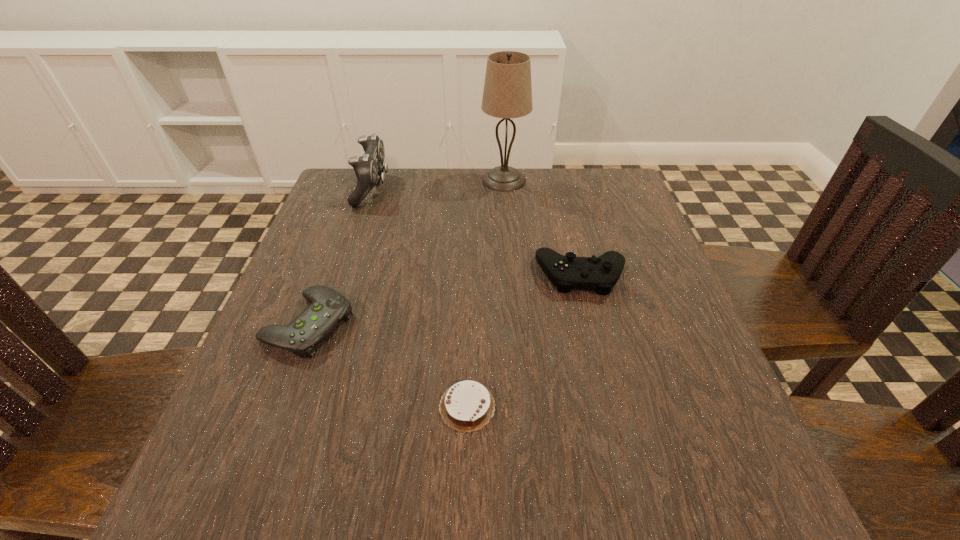
You are a GUI agent. You are given a task and a screenshot of the screen. Output one action in this format:
    pyautogui.click(x=<x>, y=<y>)
    Task: Click on the lampshade
    The image size is (960, 540).
    Given the screenshot: What is the action you would take?
    pyautogui.click(x=507, y=93)

Identify the location of the tallest control. The height and width of the screenshot is (540, 960). (368, 168).

What are the coordinates of `the second tallest object` in the screenshot? It's located at (368, 168).

Where is `the rightmost control`? Image resolution: width=960 pixels, height=540 pixels. the rightmost control is located at coordinates (600, 274).

You are a GUI agent. You are given a task and a screenshot of the screen. Output one action in this format:
    pyautogui.click(x=<x>, y=<y>)
    Task: Click on the third shortest object
    This screenshot has width=960, height=540.
    Given the screenshot: What is the action you would take?
    pyautogui.click(x=600, y=274)

The height and width of the screenshot is (540, 960). I want to click on the second shortest object, so click(328, 308).

Where is `the nearest object`? Image resolution: width=960 pixels, height=540 pixels. the nearest object is located at coordinates (468, 406).

This screenshot has height=540, width=960. I want to click on the shortest object, so click(468, 406).

At what (x,y) coordinates should I click in order to perform the action: click on blank space located on the front-facing side of the tallest object. Please return your answer as a coordinate pair (x, y). The height and width of the screenshot is (540, 960). Looking at the image, I should click on (447, 180).

Identify the location of vacant space located 0.070m on the front-facing side of the tallest object. (455, 180).